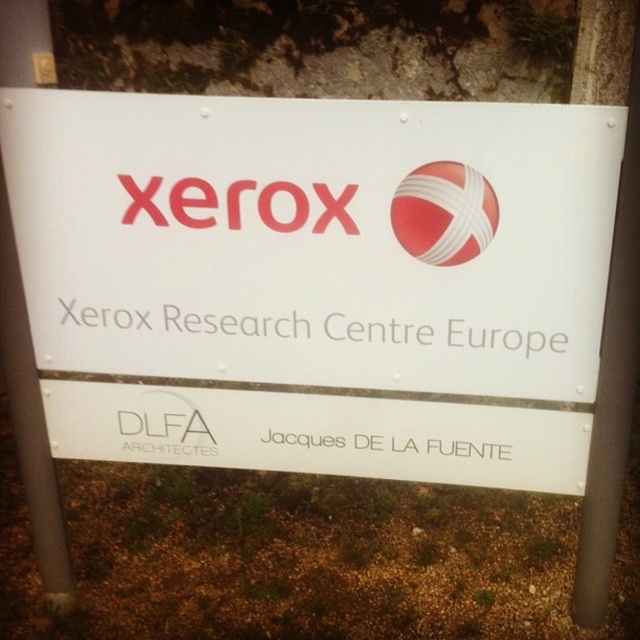
Question: Which of these objects is positioned closest to the white plastic pole at center?

Choices:
 (A) red glossy sphere at center
 (B) white metal pole at center
 (C) matte red xerox logo at center
 (D) white plastic sign at center

Answer: (A)

Question: Is white metal pole at center closer to the viewer compared to red glossy sphere at center?

Choices:
 (A) yes
 (B) no

Answer: (A)

Question: Which of these objects is positioned closest to the matte red xerox logo at center?

Choices:
 (A) red glossy sphere at center
 (B) white plastic sign at center

Answer: (B)

Question: Does red glossy sphere at center have a larger size compared to matte red xerox logo at center?

Choices:
 (A) yes
 (B) no

Answer: (B)

Question: Does white plastic pole at center appear under matte red xerox logo at center?

Choices:
 (A) yes
 (B) no

Answer: (A)

Question: Estimate the real-world distances between objects in this image. Which object is farther from the white plastic pole at center?

Choices:
 (A) white metal pole at center
 (B) white plastic sign at center
 (C) red glossy sphere at center
 (D) matte red xerox logo at center

Answer: (A)